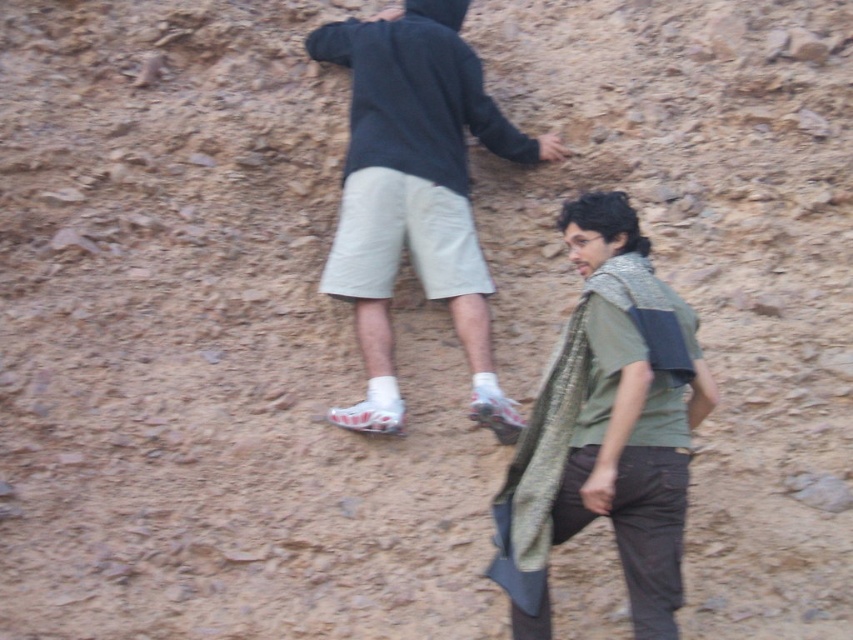
You are a hiker planning to climb the slope between the green textured shirt at center and the dark gray hoodie at upper center. The path is narrow. Your backpack is 1.15 meters wide. Can you safely pass through the path between them?

The distance between the green textured shirt at center and the dark gray hoodie at upper center is 1.20 meters. Since your backpack is 1.15 meters wide, which is narrower than the path, you can safely pass through the path between them.

You are planning to set up a safety rope for two climbers. The green textured shirt at center and the dark gray hoodie at upper center are on a steep slope. Which climber should you attach the rope to first to ensure they are closer to the base?

The green textured shirt at center should be attached first because they are positioned under the dark gray hoodie at upper center, making them closer to the base of the slope.